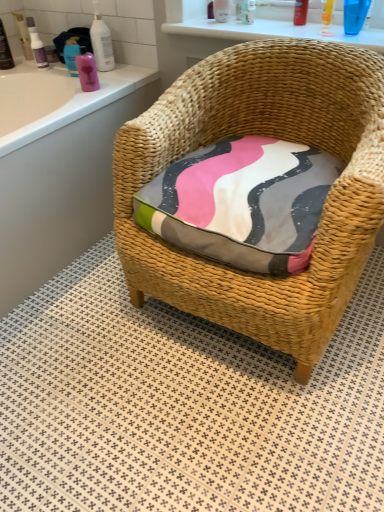
Identify the location of blank space situated above white textured tile at center (from a real-world perspective). (176, 375).